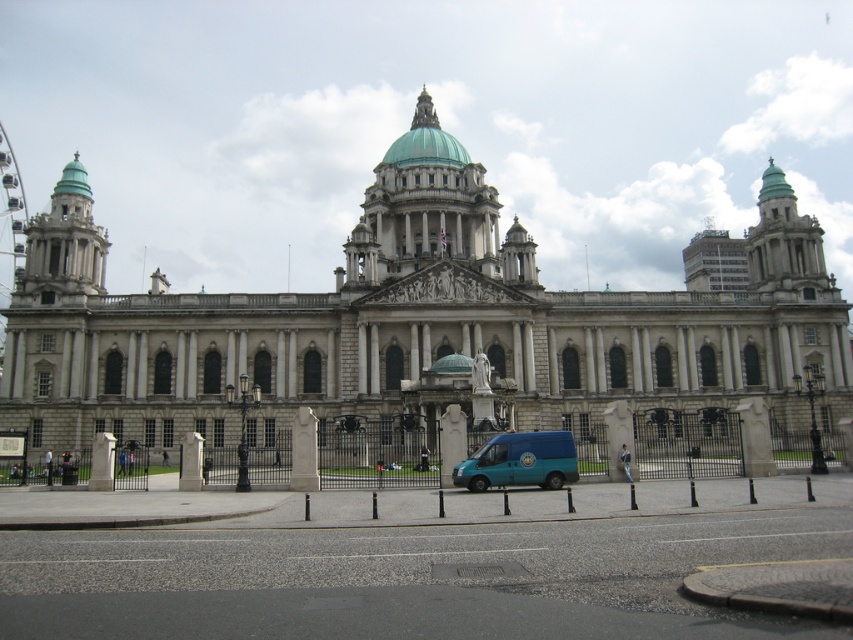
Question: Among these objects, which one is nearest to the camera?

Choices:
 (A) metallic gray drive at lower center
 (B) teal matte van at center
 (C) green glass dome at center
 (D) white stone building at center

Answer: (A)

Question: Can you confirm if teal matte van at center is positioned below green glass dome at center?

Choices:
 (A) no
 (B) yes

Answer: (B)

Question: Considering the real-world distances, which object is closest to the white stone building at center?

Choices:
 (A) metallic gray drive at lower center
 (B) teal matte van at center
 (C) green glass dome at center

Answer: (B)

Question: Which point is closer to the camera?

Choices:
 (A) metallic gray drive at lower center
 (B) teal matte van at center

Answer: (A)

Question: Does white stone building at center have a smaller size compared to teal matte van at center?

Choices:
 (A) no
 (B) yes

Answer: (A)

Question: Is white stone building at center bigger than teal matte van at center?

Choices:
 (A) yes
 (B) no

Answer: (A)